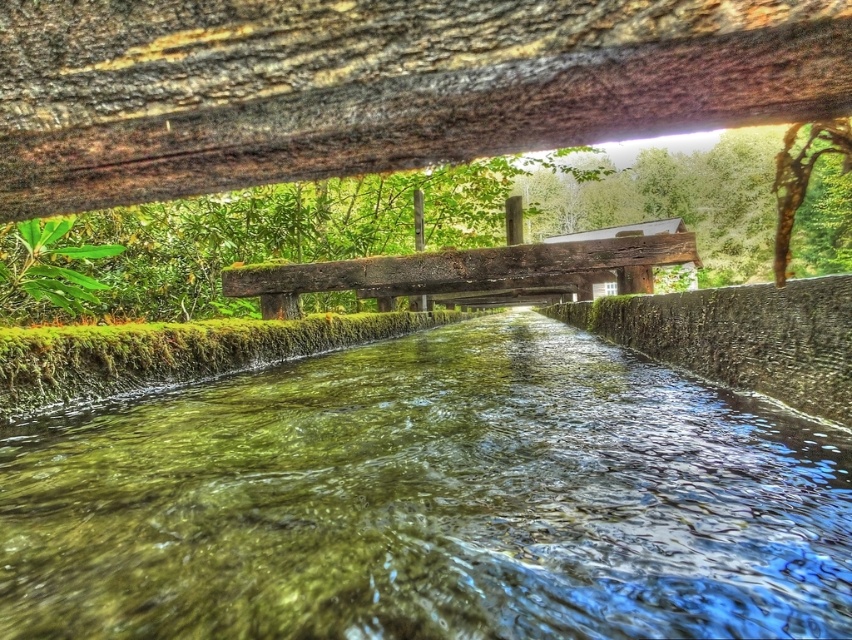
Question: Can you confirm if green mossy river at center is bigger than rustic wooden bridge at center?

Choices:
 (A) yes
 (B) no

Answer: (A)

Question: Which object appears farthest from the camera in this image?

Choices:
 (A) green mossy river at center
 (B) rustic wooden bridge at center

Answer: (B)

Question: Can you confirm if green mossy river at center is positioned to the left of rustic wooden bridge at center?

Choices:
 (A) yes
 (B) no

Answer: (A)

Question: Among these objects, which one is farthest from the camera?

Choices:
 (A) rustic wooden bridge at center
 (B) green mossy river at center

Answer: (A)

Question: Observing the image, what is the correct spatial positioning of green mossy river at center in reference to rustic wooden bridge at center?

Choices:
 (A) above
 (B) below

Answer: (B)

Question: Which of the following is the closest to the observer?

Choices:
 (A) tap(545, 252)
 (B) tap(317, 438)

Answer: (B)